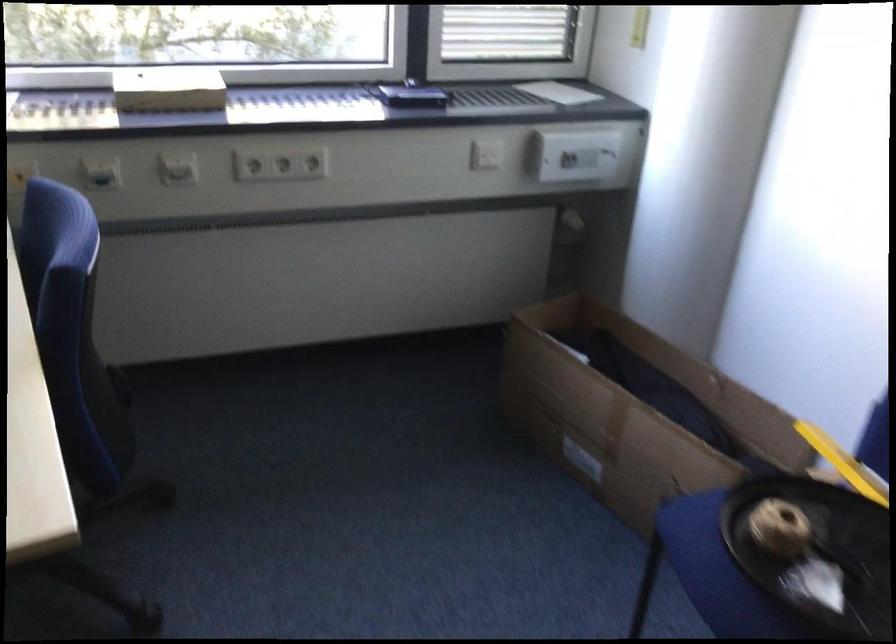
Find where to insert the safe keyhole. Please return your answer as a coordinate pair (x, y).

(570, 225)